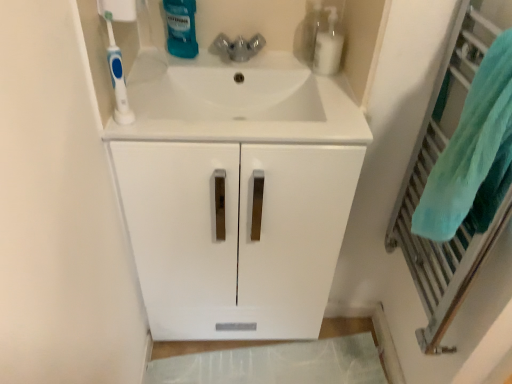
Where is `vacant area situated to the left side of clear plastic bottle at upper right, marked as the second cleaning product in a left-to-right arrangement`? vacant area situated to the left side of clear plastic bottle at upper right, marked as the second cleaning product in a left-to-right arrangement is located at coordinates (266, 64).